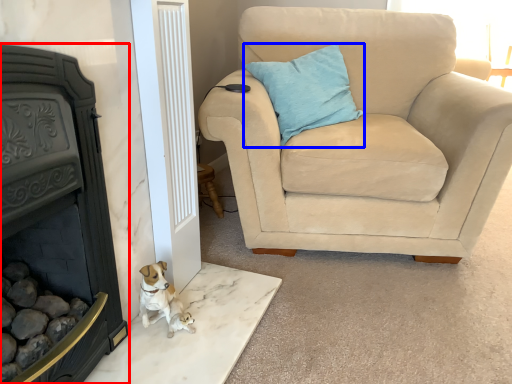
Question: Which object appears farthest to the camera in this image, fireplace (highlighted by a red box) or pillow (highlighted by a blue box)?

Choices:
 (A) fireplace
 (B) pillow

Answer: (B)